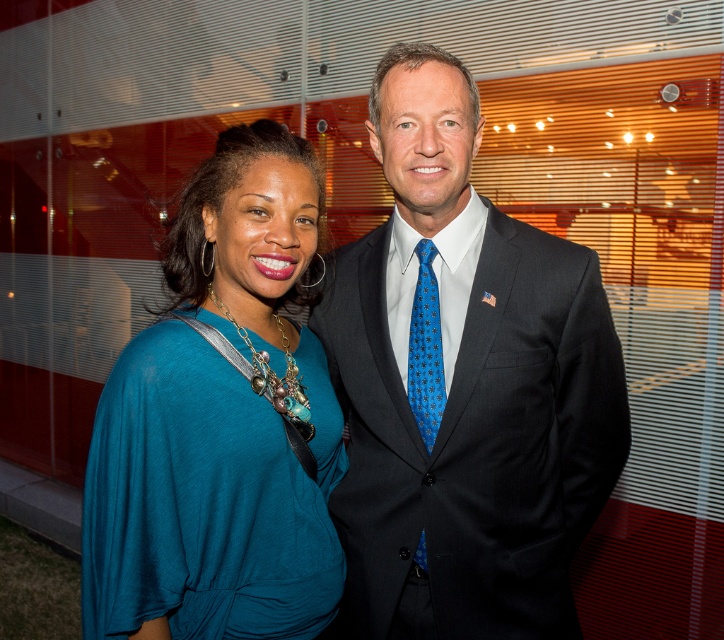
You are a photographer setting up a photo shoot for two models wearing the dark gray suit at center and the teal fabric dress at center. You need to ensure that the camera captures both subjects clearly. Based on their heights, which model should stand closer to the camera to avoid one blocking the other?

The dark gray suit at center is much taller than the teal fabric dress at center, so the teal fabric dress at center should stand closer to the camera to prevent the taller model from blocking the shorter one.

You are a photographer setting up a photo shoot for two models wearing the dark gray suit at center and the teal fabric dress at center. You need to ensure that the clothing items are visible in the frame. Which clothing item should you focus on first to ensure it fits within the camera frame?

The dark gray suit at center is larger in size than the teal fabric dress at center, so you should focus on ensuring the dark gray suit at center fits within the camera frame first to accommodate its larger size.

You are a photographer trying to capture a group photo of the dark gray suit at center and the teal fabric dress at center. Since you want to ensure both subjects are clearly visible in the frame, which subject should you position closer to the camera to avoid being blocked by the other?

The dark gray suit at center should be positioned closer to the camera because it is on the right side of the teal fabric dress at center, so moving it forward will prevent it from being obscured.